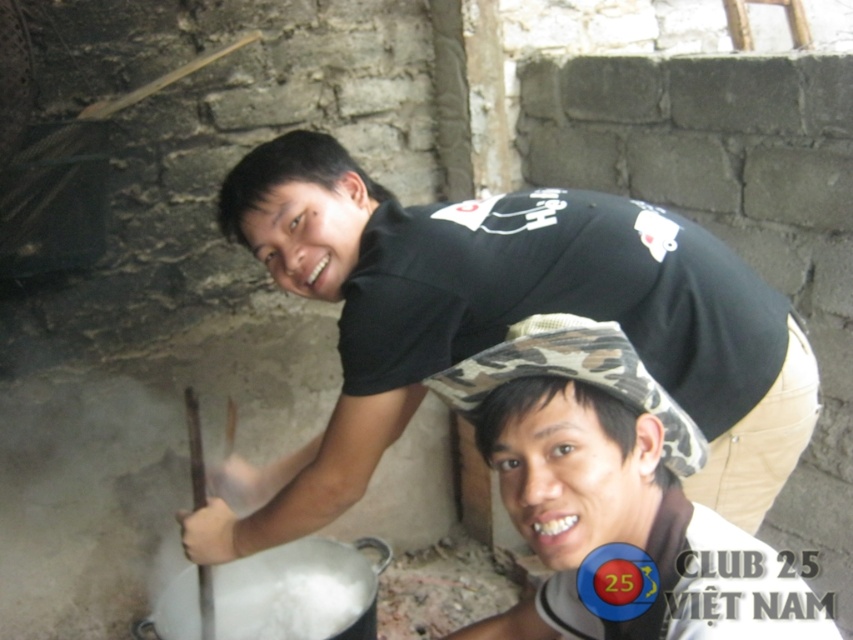
Question: Which point is farther to the camera?

Choices:
 (A) camouflage hat at center
 (B) black matte shirt at upper center

Answer: (B)

Question: Which point is closer to the camera?

Choices:
 (A) (589, 353)
 (B) (421, 333)

Answer: (A)

Question: Is black matte shirt at upper center closer to the viewer compared to camouflage hat at center?

Choices:
 (A) no
 (B) yes

Answer: (A)

Question: Does black matte shirt at upper center come in front of camouflage hat at center?

Choices:
 (A) no
 (B) yes

Answer: (A)

Question: From the image, what is the correct spatial relationship of black matte shirt at upper center in relation to camouflage hat at center?

Choices:
 (A) below
 (B) above

Answer: (B)

Question: Which point is closer to the camera?

Choices:
 (A) camouflage hat at center
 (B) black matte shirt at upper center

Answer: (A)